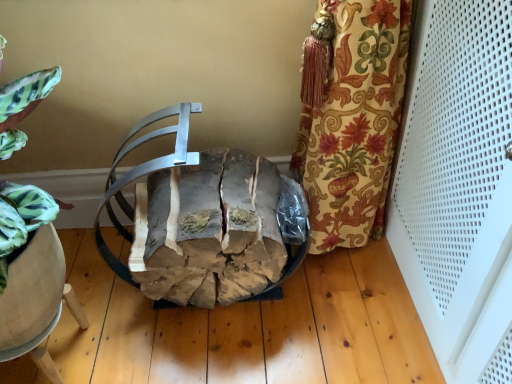
Question: Is rustic wood log at center smaller than wooden chair at lower left?

Choices:
 (A) yes
 (B) no

Answer: (B)

Question: Is wooden chair at lower left a part of rustic wood log at center?

Choices:
 (A) no
 (B) yes

Answer: (A)

Question: Is rustic wood log at center far away from wooden chair at lower left?

Choices:
 (A) no
 (B) yes

Answer: (A)

Question: Can you confirm if rustic wood log at center is wider than wooden chair at lower left?

Choices:
 (A) yes
 (B) no

Answer: (A)

Question: Is rustic wood log at center completely or partially outside of wooden chair at lower left?

Choices:
 (A) yes
 (B) no

Answer: (A)

Question: From a real-world perspective, does rustic wood log at center sit lower than wooden chair at lower left?

Choices:
 (A) no
 (B) yes

Answer: (A)

Question: From the image's perspective, does wooden chair at lower left appear higher than rustic wood log at center?

Choices:
 (A) no
 (B) yes

Answer: (A)

Question: Is wooden chair at lower left far away from rustic wood log at center?

Choices:
 (A) yes
 (B) no

Answer: (B)

Question: Does wooden chair at lower left have a greater height compared to rustic wood log at center?

Choices:
 (A) yes
 (B) no

Answer: (B)

Question: From a real-world perspective, is wooden chair at lower left over rustic wood log at center?

Choices:
 (A) yes
 (B) no

Answer: (B)

Question: Can we say wooden chair at lower left lies outside rustic wood log at center?

Choices:
 (A) no
 (B) yes

Answer: (B)

Question: Is wooden chair at lower left shorter than rustic wood log at center?

Choices:
 (A) yes
 (B) no

Answer: (A)

Question: Is point (227, 289) positioned closer to the camera than point (53, 322)?

Choices:
 (A) farther
 (B) closer

Answer: (A)